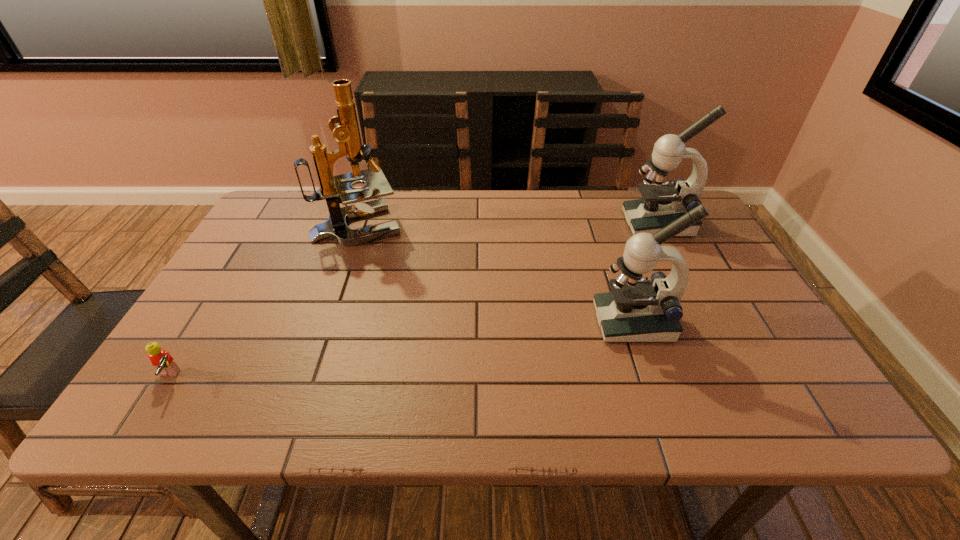
I want to click on object situated at the left edge, so click(x=161, y=359).

This screenshot has height=540, width=960. Find the location of `object that is at the right edge`. object that is at the right edge is located at coordinates 662,203.

Find the location of `object located in the near left corner section of the desktop`. object located in the near left corner section of the desktop is located at coordinates (161, 359).

This screenshot has height=540, width=960. I want to click on object located in the far right corner section of the desktop, so click(x=662, y=203).

Locate an element on the screen. Image resolution: width=960 pixels, height=540 pixels. free space at the far edge of the desktop is located at coordinates (601, 193).

I want to click on free spot at the near edge of the desktop, so click(x=713, y=404).

Locate an element on the screen. This screenshot has height=540, width=960. vacant space at the left edge is located at coordinates (258, 305).

In the image, there is a desktop. At what (x,y) coordinates should I click in order to perform the action: click on free space at the right edge. Please return your answer as a coordinate pair (x, y). Looking at the image, I should click on (799, 382).

You are a GUI agent. You are given a task and a screenshot of the screen. Output one action in this format:
    pyautogui.click(x=<x>, y=<y>)
    Task: Click on the vacant space at the far left corner of the desktop
    
    Given the screenshot: What is the action you would take?
    pyautogui.click(x=284, y=202)

Locate an element on the screen. vacant space at the near left corner of the desktop is located at coordinates (158, 421).